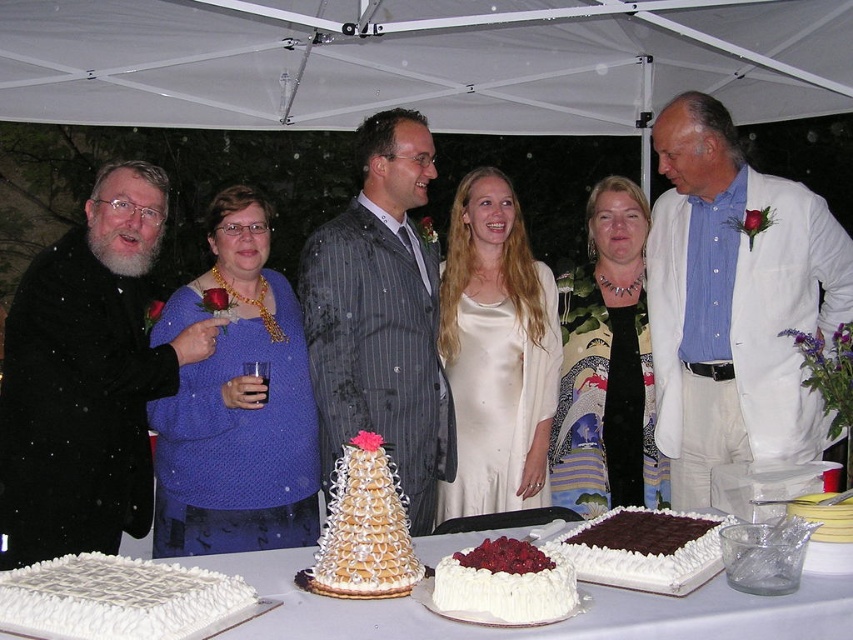
Question: Which point is farther from the camera taking this photo?

Choices:
 (A) (602, 499)
 (B) (639, 612)

Answer: (A)

Question: Can you confirm if pinstriped suit at center is bigger than chocolate frosted cake at center?

Choices:
 (A) yes
 (B) no

Answer: (A)

Question: Is white cotton suit at center wider than black matte coat at left?

Choices:
 (A) no
 (B) yes

Answer: (B)

Question: Is satin dress at center closer to the viewer compared to white frosted cake at center?

Choices:
 (A) no
 (B) yes

Answer: (A)

Question: Which point is farther from the camera taking this photo?

Choices:
 (A) (526, 621)
 (B) (360, 296)
 (C) (474, 384)
 (D) (701, 515)

Answer: (C)

Question: Which point is farther to the camera?

Choices:
 (A) (390, 637)
 (B) (535, 426)

Answer: (B)